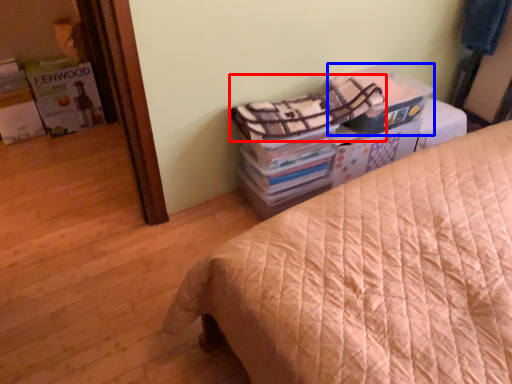
Question: Which of the following is the closest to the observer, blanket (highlighted by a red box) or cardboard box (highlighted by a blue box)?

Choices:
 (A) blanket
 (B) cardboard box

Answer: (A)